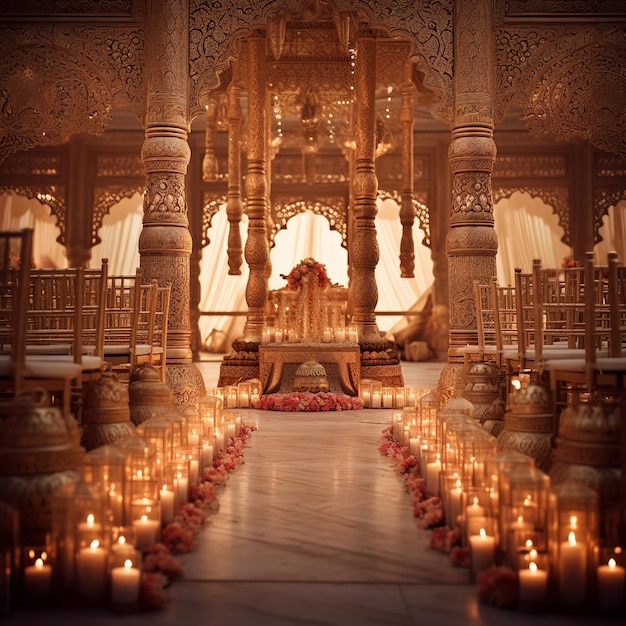
Find the location of a particular element. bench is located at coordinates (109, 330).